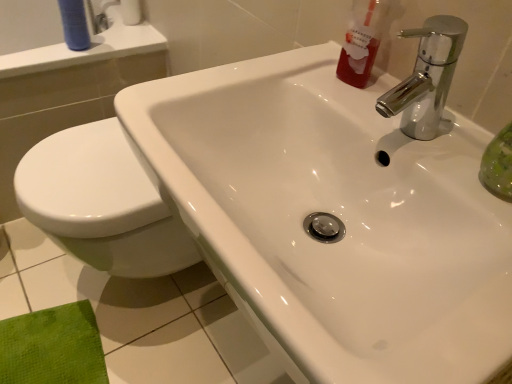
Question: Considering the relative positions of white paper towel at upper left and translucent red liquid at upper right in the image provided, is white paper towel at upper left to the left or to the right of translucent red liquid at upper right?

Choices:
 (A) right
 (B) left

Answer: (B)

Question: Considering the positions of white paper towel at upper left and translucent red liquid at upper right in the image, is white paper towel at upper left wider or thinner than translucent red liquid at upper right?

Choices:
 (A) wide
 (B) thin

Answer: (A)

Question: Estimate the real-world distances between objects in this image. Which object is closer to the white paper towel at upper left?

Choices:
 (A) chrome metallic faucet at upper right
 (B) translucent red liquid at upper right
 (C) blue matte tube at upper left

Answer: (C)

Question: Which object is the closest to the blue matte tube at upper left?

Choices:
 (A) chrome metallic faucet at upper right
 (B) translucent red liquid at upper right
 (C) white paper towel at upper left

Answer: (C)